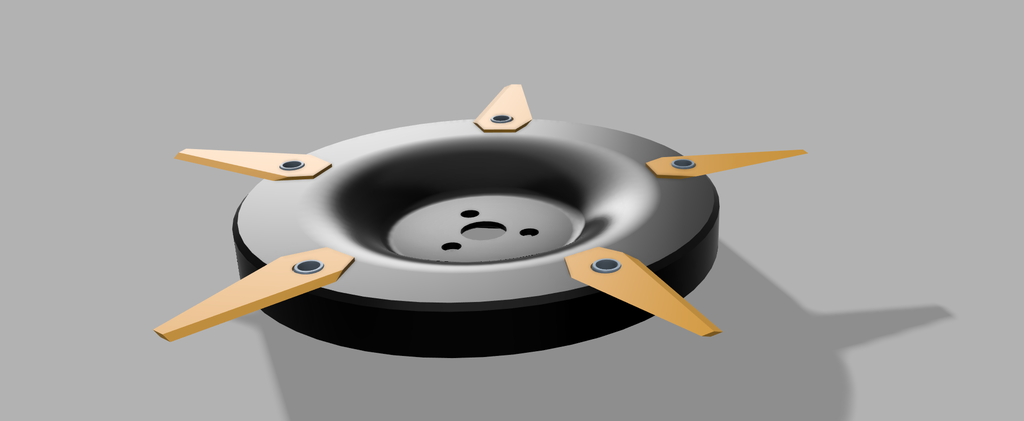
Identify the location of corner. (989, 389), (38, 398), (31, 8), (1006, 21).